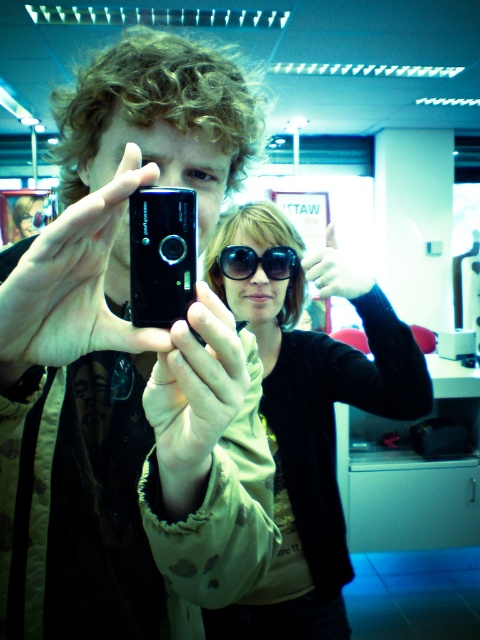
Between matte black hand at center and black shiny sunglasses at center, which one appears on the right side from the viewer's perspective?

matte black hand at center is more to the right.

Who is positioned more to the left, matte black hand at center or black shiny sunglasses at center?

From the viewer's perspective, black shiny sunglasses at center appears more on the left side.

The height and width of the screenshot is (640, 480). Identify the location of matte black hand at center. (336, 269).

Locate an element on the screen. The width and height of the screenshot is (480, 640). matte black hand at center is located at coordinates (336, 269).

Find the location of a particular element. black matte camera at center is located at coordinates (72, 284).

Consider the image. Is black matte camera at center wider than black shiny sunglasses at center?

In fact, black matte camera at center might be narrower than black shiny sunglasses at center.

Which is in front, point (152, 348) or point (228, 259)?

Point (152, 348) is more forward.

Identify the location of black matte camera at center. The width and height of the screenshot is (480, 640). (72, 284).

Is sunglasses at center taller than black shiny sunglasses at center?

Yes.

Between sunglasses at center and black shiny sunglasses at center, which one has less height?

Standing shorter between the two is black shiny sunglasses at center.

Where is `sunglasses at center`? The width and height of the screenshot is (480, 640). sunglasses at center is located at coordinates (309, 422).

The height and width of the screenshot is (640, 480). Identify the location of sunglasses at center. (309, 422).